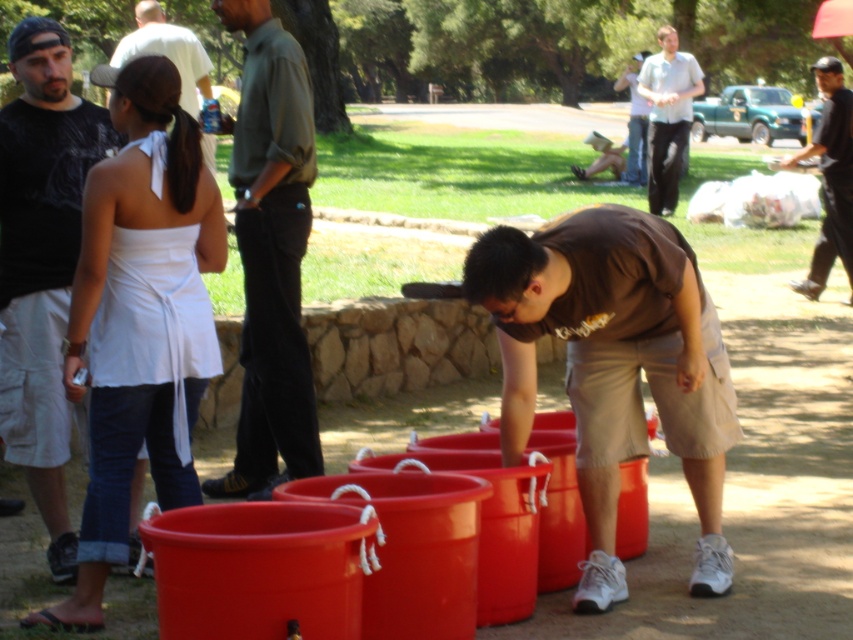
You are standing at the park and see two points marked in the scene. Which point is closer to you, point (664,200) or point (152,4)?

Point (152,4) is closer to you because it is less further to the camera than point (664,200).

You are a photographer at this event and want to capture both the light gray shirt at upper center and the white fabric dress at upper left in the same frame. Which person should be on the left side of the photo?

The white fabric dress at upper left should be on the left side of the photo because the light gray shirt at upper center is positioned on the right side of it.